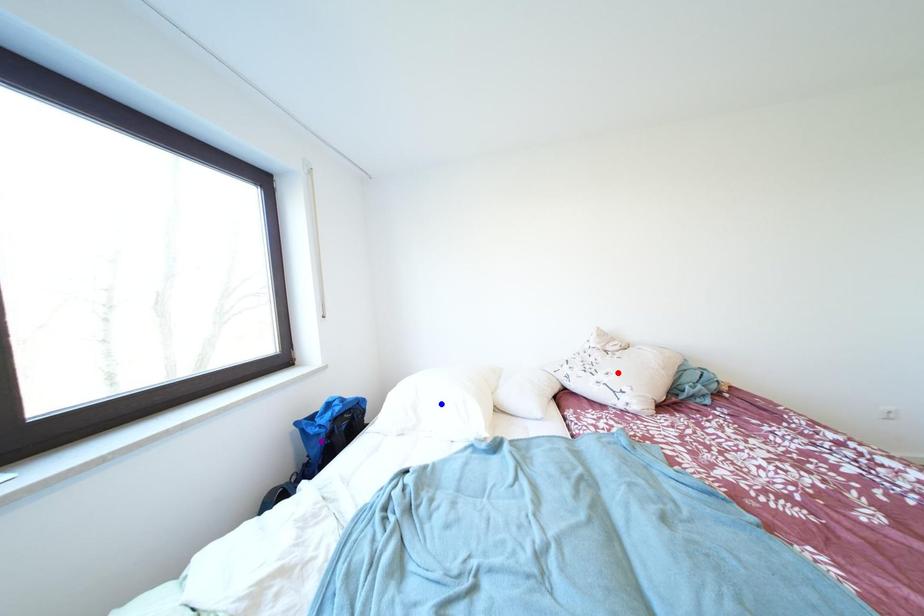
Order these from nearest to farthest:
- red point
- blue point
- purple point

purple point, blue point, red point